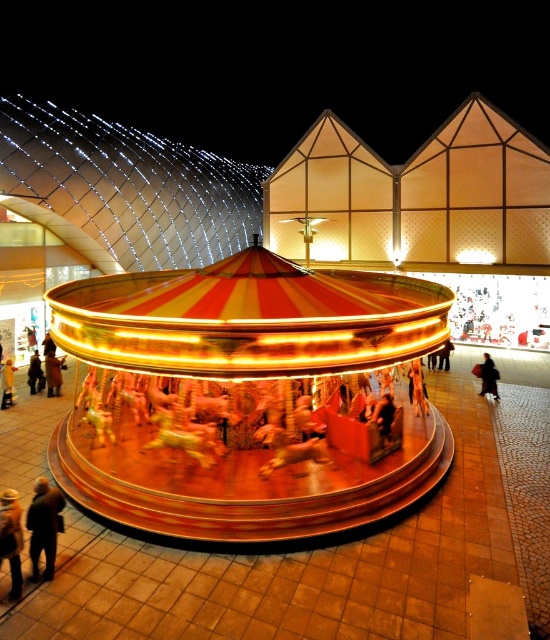
Between orange fabric jacket at lower left and black fabric at center, which one appears on the left side from the viewer's perspective?

Positioned to the left is orange fabric jacket at lower left.

Who is positioned more to the right, orange fabric jacket at lower left or black fabric at center?

black fabric at center is more to the right.

Is point (8, 538) positioned after point (492, 394)?

No, it is not.

Where is `orange fabric jacket at lower left`? orange fabric jacket at lower left is located at coordinates [12, 538].

Between point (111, 408) and point (481, 392), which one is positioned in front?

Point (111, 408) is in front.

Is point (282, 509) closer to viewer compared to point (490, 358)?

Yes, point (282, 509) is closer to viewer.

The height and width of the screenshot is (640, 550). Describe the element at coordinates (246, 397) in the screenshot. I see `shiny gold carousel at center` at that location.

Identify the location of shiny gold carousel at center. (246, 397).

Consider the image. Does shiny gold carousel at center appear on the right side of dark brown leather jacket at lower left?

Yes, shiny gold carousel at center is to the right of dark brown leather jacket at lower left.

Does point (256, 362) come in front of point (29, 520)?

That is False.

Is point (207, 304) positioned in front of point (30, 554)?

That is False.

Find the location of `shiny gold carousel at center`. shiny gold carousel at center is located at coordinates (246, 397).